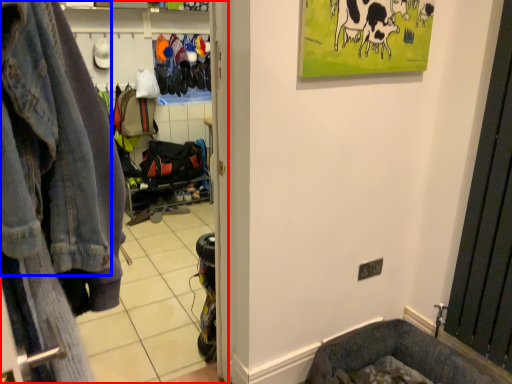
Question: Which point is closer to the camera, clothing store (highlighted by a red box) or denim jacket (highlighted by a blue box)?

Choices:
 (A) clothing store
 (B) denim jacket

Answer: (B)